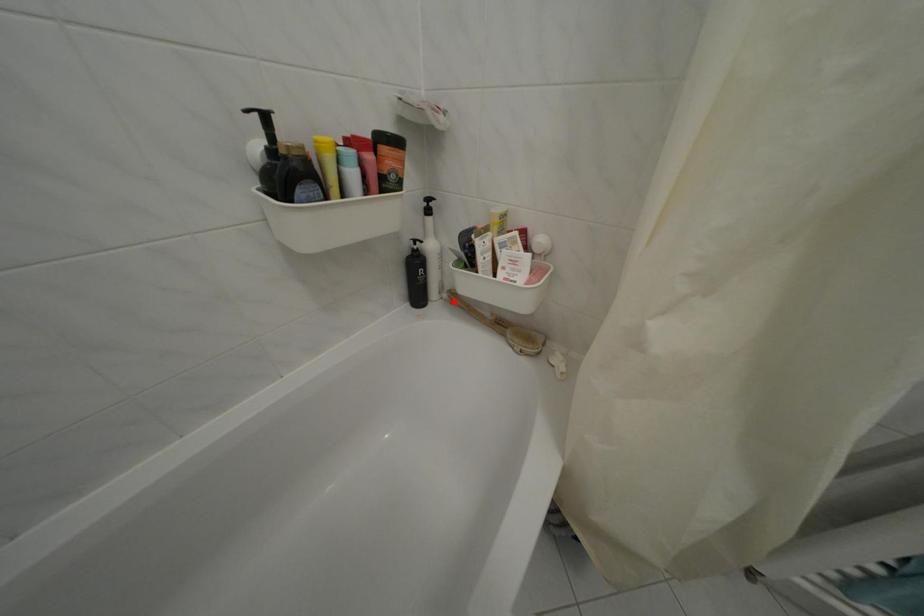
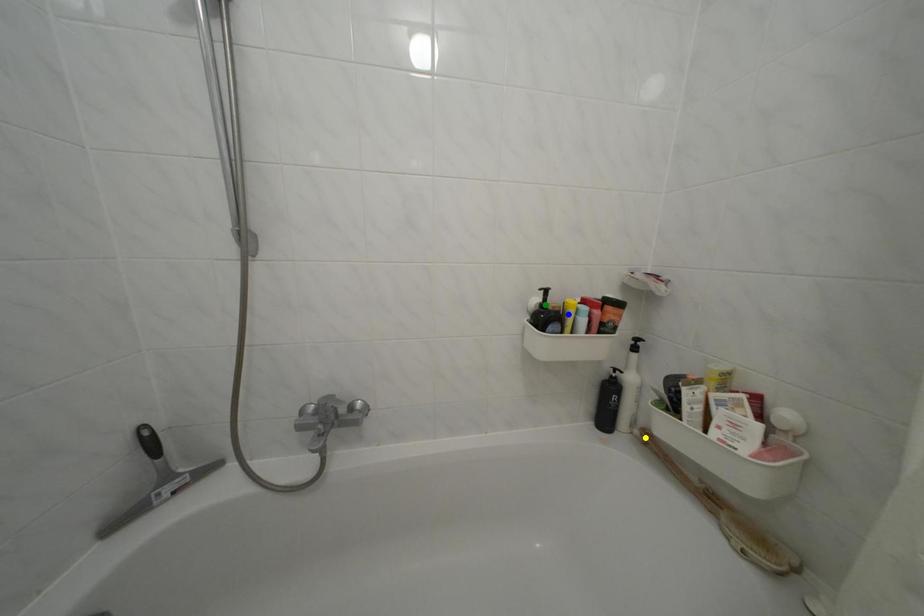
Question: I am providing you with two images of the same scene from different viewpoints. A red point is marked on the first image. You are given multiple points on the second image. Which point in image 2 is actually the same real-world point as the red point in image 1?

Choices:
 (A) yellow point
 (B) blue point
 (C) green point

Answer: (A)